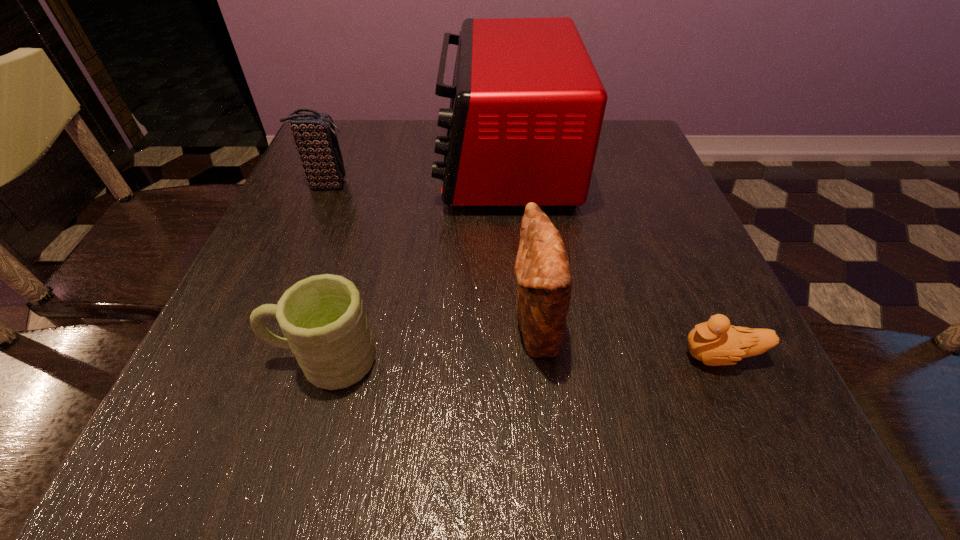
Image resolution: width=960 pixels, height=540 pixels. I want to click on vacant region located 0.350m on the open side of the nearer clutch bag, so click(x=283, y=327).

I want to click on vacant region located on the open side of the nearer clutch bag, so click(296, 327).

Where is `vacant space located with the zip open on the farther clutch bag`? vacant space located with the zip open on the farther clutch bag is located at coordinates (514, 185).

Locate an element on the screen. Image resolution: width=960 pixels, height=540 pixels. vacant position located 0.100m on the side of the second shortest object with the handle is located at coordinates (203, 360).

I want to click on vacant space located 0.200m on the face of the rightmost object, so click(x=542, y=356).

Find the location of a particular element. The width and height of the screenshot is (960, 540). vacant region located on the face of the rightmost object is located at coordinates (433, 356).

This screenshot has height=540, width=960. Identify the location of free space located on the face of the rightmost object. (522, 356).

At what (x,y) coordinates should I click in order to perform the action: click on object that is at the far edge. Please return your answer as a coordinate pair (x, y). The width and height of the screenshot is (960, 540). Looking at the image, I should click on (527, 105).

Find the location of a particular element. This screenshot has height=540, width=960. clutch bag that is at the left edge is located at coordinates (314, 134).

Where is `mug situated at the left edge`? This screenshot has height=540, width=960. mug situated at the left edge is located at coordinates (322, 318).